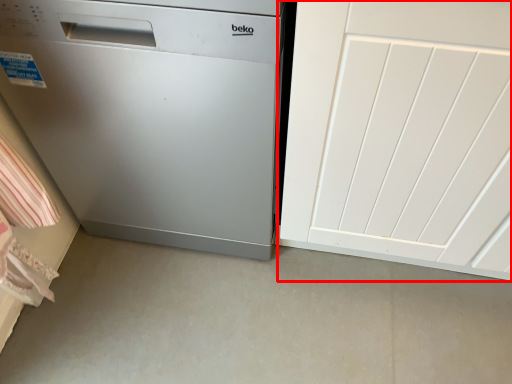
Question: From the image's perspective, where is door (annotated by the red box) located relative to home appliance?

Choices:
 (A) above
 (B) below

Answer: (B)